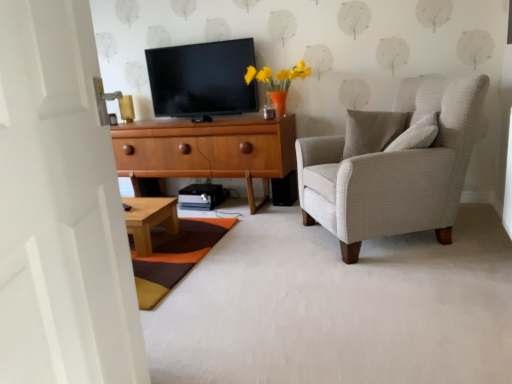
Question: Is light gray fabric armchair at right surrounded by multicolored woven mat at lower center?

Choices:
 (A) yes
 (B) no

Answer: (B)

Question: Could you tell me if multicolored woven mat at lower center is turned towards light gray fabric armchair at right?

Choices:
 (A) yes
 (B) no

Answer: (B)

Question: Is multicolored woven mat at lower center located outside light gray fabric armchair at right?

Choices:
 (A) no
 (B) yes

Answer: (B)

Question: From a real-world perspective, is multicolored woven mat at lower center below light gray fabric armchair at right?

Choices:
 (A) no
 (B) yes

Answer: (B)

Question: Is multicolored woven mat at lower center at the left side of light gray fabric armchair at right?

Choices:
 (A) no
 (B) yes

Answer: (B)

Question: Relative to light gray fabric armchair at right, is wooden cabinet at center in front or behind?

Choices:
 (A) behind
 (B) front

Answer: (A)

Question: From the image's perspective, is wooden cabinet at center located above or below light gray fabric armchair at right?

Choices:
 (A) below
 (B) above

Answer: (B)

Question: Do you think wooden cabinet at center is within light gray fabric armchair at right, or outside of it?

Choices:
 (A) inside
 (B) outside

Answer: (B)

Question: Looking at their shapes, would you say wooden cabinet at center is wider or thinner than light gray fabric armchair at right?

Choices:
 (A) wide
 (B) thin

Answer: (B)

Question: Is black glossy tv at upper center bigger or smaller than wooden cabinet at center?

Choices:
 (A) small
 (B) big

Answer: (A)

Question: From the image's perspective, is black glossy tv at upper center located above or below wooden cabinet at center?

Choices:
 (A) above
 (B) below

Answer: (A)

Question: Is black glossy tv at upper center taller or shorter than wooden cabinet at center?

Choices:
 (A) tall
 (B) short

Answer: (B)

Question: From a real-world perspective, is black glossy tv at upper center physically located above or below wooden cabinet at center?

Choices:
 (A) below
 (B) above

Answer: (B)

Question: Considering the positions of light gray fabric armchair at right and white wooden door at left in the image, is light gray fabric armchair at right taller or shorter than white wooden door at left?

Choices:
 (A) tall
 (B) short

Answer: (B)

Question: Is point (433, 86) positioned closer to the camera than point (54, 203)?

Choices:
 (A) closer
 (B) farther

Answer: (B)